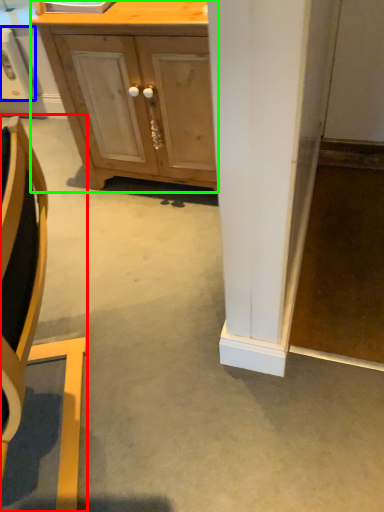
Question: Based on their relative distances, which object is nearer to chair (highlighted by a red box)? Choose from appliance (highlighted by a blue box) and cabinetry (highlighted by a green box).

Choices:
 (A) appliance
 (B) cabinetry

Answer: (B)